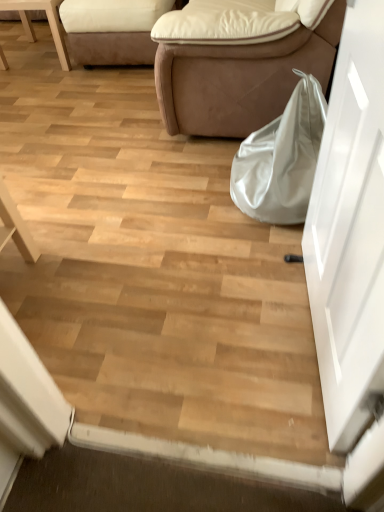
Locate an element on the screen. free location in front of satin white bag at lower right is located at coordinates (249, 261).